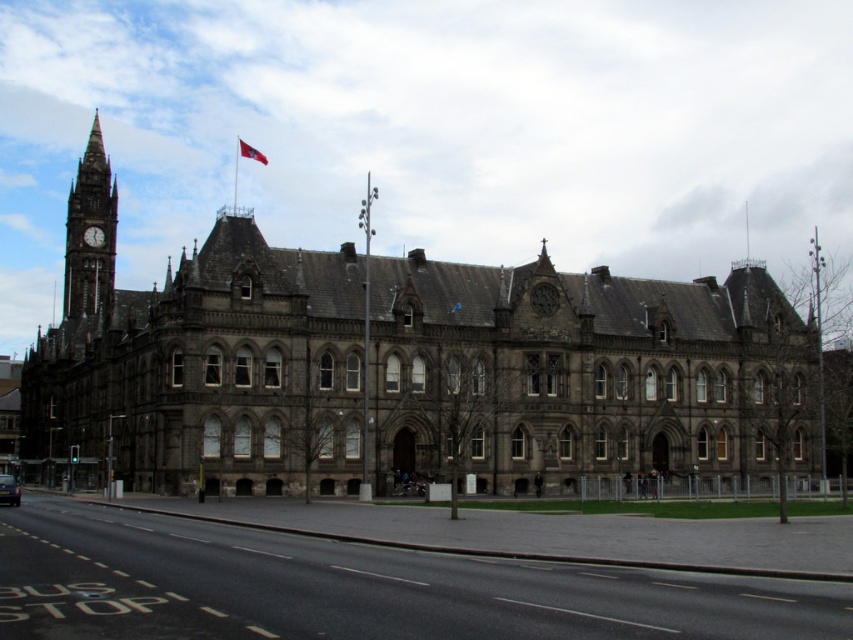
Question: In this image, where is dark gray stone clock tower at left located relative to red fabric flag at upper center?

Choices:
 (A) left
 (B) right

Answer: (A)

Question: Among these points, which one is farthest from the camera?

Choices:
 (A) (9, 486)
 (B) (83, 262)
 (C) (94, 237)

Answer: (C)

Question: Does matte gray clock at upper left have a lesser width compared to red fabric flag at upper center?

Choices:
 (A) yes
 (B) no

Answer: (A)

Question: Is matte gray clock at upper left above red fabric flag at center?

Choices:
 (A) yes
 (B) no

Answer: (A)

Question: Which object is the farthest from the dark gray stone clock tower at left?

Choices:
 (A) matte gray clock at upper left
 (B) red fabric flag at center

Answer: (B)

Question: Considering the real-world distances, which object is closest to the dark gray stone clock tower at left?

Choices:
 (A) red fabric flag at upper center
 (B) metallic silver car at lower left
 (C) matte gray clock at upper left

Answer: (C)